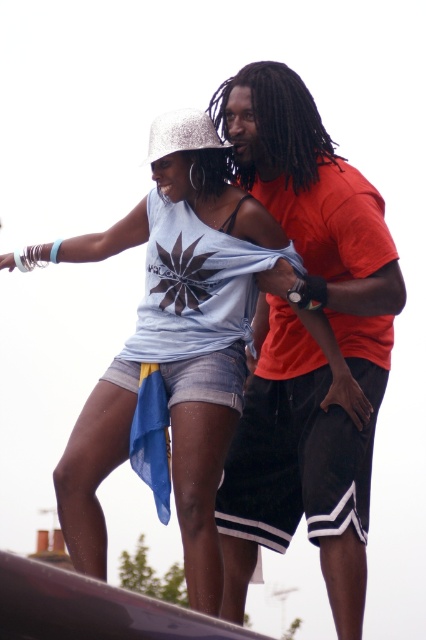
Can you confirm if orange matte shirt at upper right is shorter than matte blue denim shorts at center?

No.

Between orange matte shirt at upper right and matte blue denim shorts at center, which one has less height?

With less height is matte blue denim shorts at center.

What do you see at coordinates (305, 344) in the screenshot? I see `orange matte shirt at upper right` at bounding box center [305, 344].

You are a GUI agent. You are given a task and a screenshot of the screen. Output one action in this format:
    pyautogui.click(x=<x>, y=<y>)
    Task: Click on the orange matte shirt at upper right
    The image size is (426, 640).
    Given the screenshot: What is the action you would take?
    pyautogui.click(x=305, y=344)